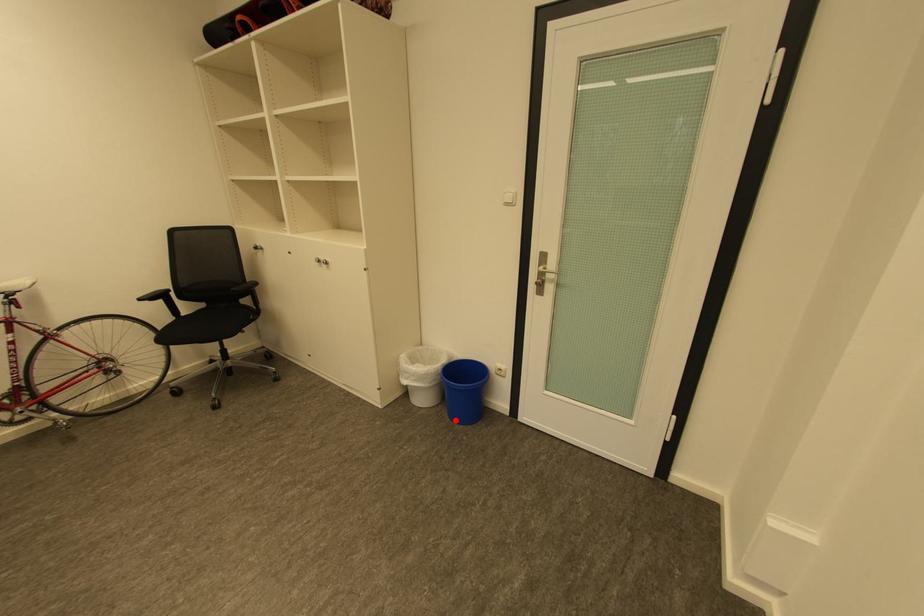
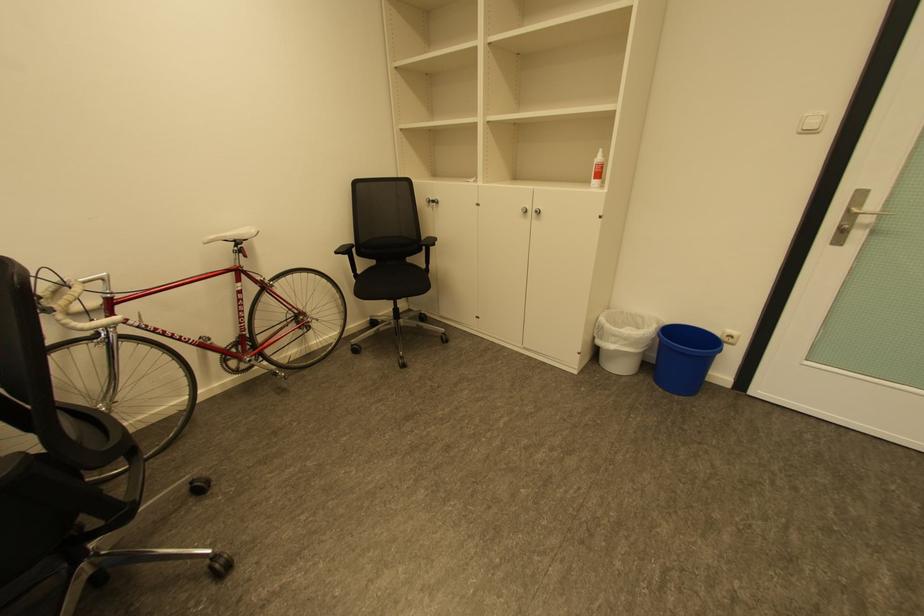
In the second image, find the point that corresponds to the highlighted location in the first image.

(667, 390)